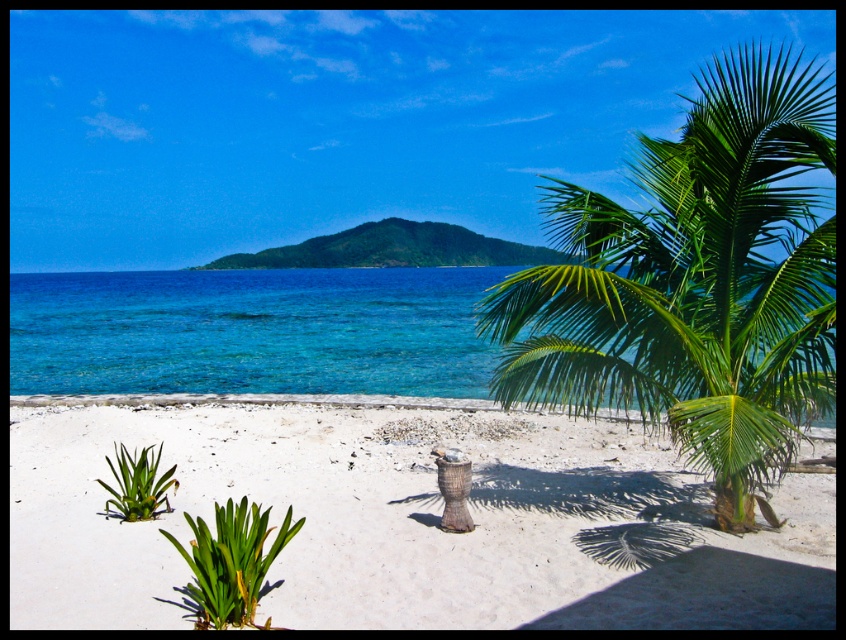
Which of these two, white sandy beach at center or green leafy palm at center, stands taller?

Standing taller between the two is green leafy palm at center.

Is white sandy beach at center thinner than green leafy palm at center?

Yes, white sandy beach at center is thinner than green leafy palm at center.

At what (x,y) coordinates should I click in order to perform the action: click on white sandy beach at center. Please return your answer as a coordinate pair (x, y). The width and height of the screenshot is (846, 640). Looking at the image, I should click on (410, 524).

In the scene shown: Does white sandy beach at center appear over clear blue water at center?

Incorrect, white sandy beach at center is not positioned above clear blue water at center.

Measure the distance between white sandy beach at center and camera.

15.18 feet

This screenshot has height=640, width=846. What do you see at coordinates (410, 524) in the screenshot? I see `white sandy beach at center` at bounding box center [410, 524].

Where is `white sandy beach at center`? This screenshot has width=846, height=640. white sandy beach at center is located at coordinates (410, 524).

Can you confirm if green leafy palm at center is bigger than clear blue water at center?

Yes, green leafy palm at center is bigger than clear blue water at center.

Which is in front, point (688, 157) or point (14, 387)?

Point (688, 157) is in front.

Is point (695, 380) behind point (140, 353)?

No.

Find the location of a particular element. The image size is (846, 640). green leafy palm at center is located at coordinates (695, 282).